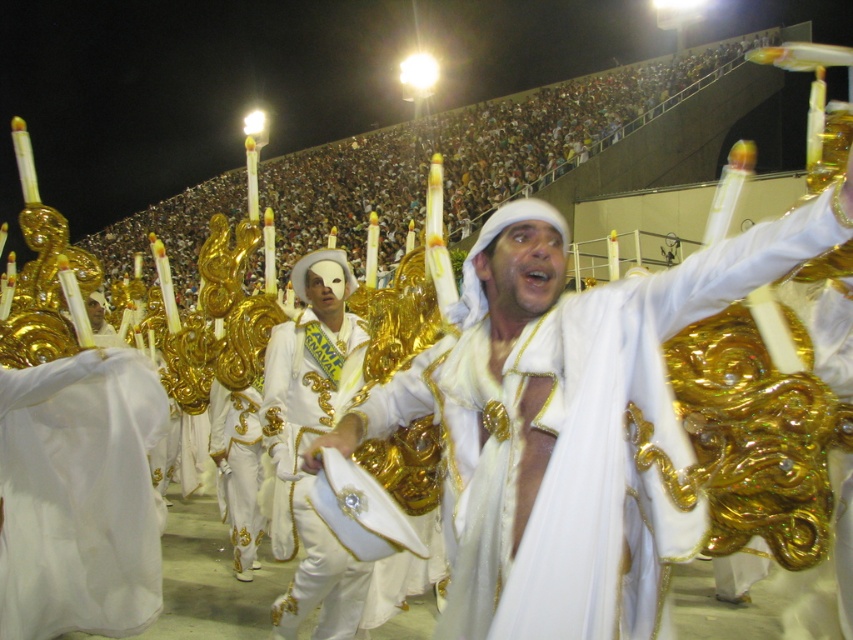
Question: Can you confirm if white satin robe at center is positioned below white satin robe at lower left?

Choices:
 (A) yes
 (B) no

Answer: (B)

Question: Is white satin robe at center bigger than white satin robe at lower left?

Choices:
 (A) no
 (B) yes

Answer: (B)

Question: Which point is farther to the camera?

Choices:
 (A) (572, 474)
 (B) (61, 561)

Answer: (B)

Question: Which of the following is the farthest from the observer?

Choices:
 (A) (608, 397)
 (B) (30, 588)

Answer: (B)

Question: Which of the following is the closest to the observer?

Choices:
 (A) white satin robe at center
 (B) white satin robe at lower left

Answer: (A)

Question: Does white satin robe at center have a larger size compared to white satin robe at lower left?

Choices:
 (A) yes
 (B) no

Answer: (A)